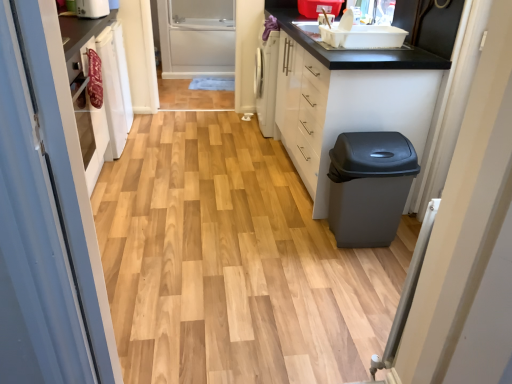
Question: Is white plastic toaster at upper left touching matte gray trash can at right?

Choices:
 (A) yes
 (B) no

Answer: (B)

Question: Can you confirm if white plastic toaster at upper left is smaller than matte gray trash can at right?

Choices:
 (A) yes
 (B) no

Answer: (A)

Question: Can you confirm if white plastic toaster at upper left is wider than matte gray trash can at right?

Choices:
 (A) yes
 (B) no

Answer: (B)

Question: From a real-world perspective, is white plastic toaster at upper left under matte gray trash can at right?

Choices:
 (A) yes
 (B) no

Answer: (B)

Question: Is matte gray trash can at right surrounded by white plastic toaster at upper left?

Choices:
 (A) no
 (B) yes

Answer: (A)

Question: In terms of width, does white glossy cabinet at right look wider or thinner when compared to white plastic toaster at upper left?

Choices:
 (A) wide
 (B) thin

Answer: (A)

Question: From the image's perspective, is white glossy cabinet at right located above or below white plastic toaster at upper left?

Choices:
 (A) below
 (B) above

Answer: (A)

Question: In terms of height, does white glossy cabinet at right look taller or shorter compared to white plastic toaster at upper left?

Choices:
 (A) tall
 (B) short

Answer: (A)

Question: Considering the positions of point (301, 39) and point (78, 14), is point (301, 39) closer or farther from the camera than point (78, 14)?

Choices:
 (A) closer
 (B) farther

Answer: (B)

Question: From the image's perspective, is white plastic toaster at upper left positioned above or below clear glass screen door at center?

Choices:
 (A) above
 (B) below

Answer: (A)

Question: In terms of size, does white plastic toaster at upper left appear bigger or smaller than clear glass screen door at center?

Choices:
 (A) small
 (B) big

Answer: (A)

Question: From a real-world perspective, is white plastic toaster at upper left positioned above or below clear glass screen door at center?

Choices:
 (A) above
 (B) below

Answer: (A)

Question: Is point (89, 1) closer or farther from the camera than point (181, 29)?

Choices:
 (A) closer
 (B) farther

Answer: (A)

Question: Based on their sizes in the image, would you say white plastic toaster at upper left is bigger or smaller than matte gray trash can at right?

Choices:
 (A) small
 (B) big

Answer: (A)

Question: Considering the positions of point (97, 14) and point (353, 183), is point (97, 14) closer or farther from the camera than point (353, 183)?

Choices:
 (A) closer
 (B) farther

Answer: (B)